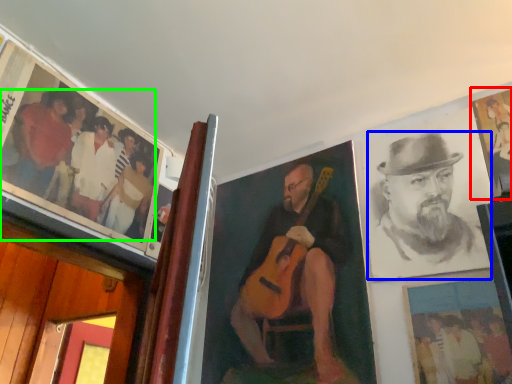
Question: Estimate the real-world distances between objects in this image. Which object is closer to picture frame (highlighted by a red box), man (highlighted by a blue box) or person (highlighted by a green box)?

Choices:
 (A) man
 (B) person

Answer: (A)